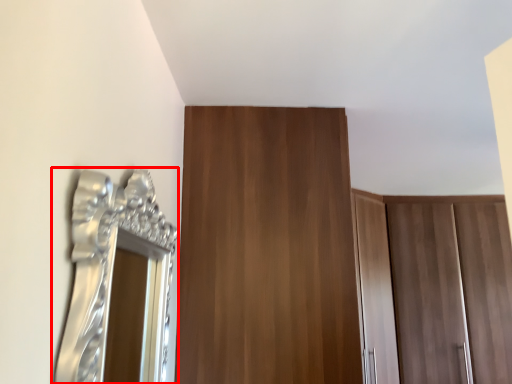
Question: From the image's perspective, where is mirror (annotated by the red box) located relative to door?

Choices:
 (A) above
 (B) below

Answer: (A)